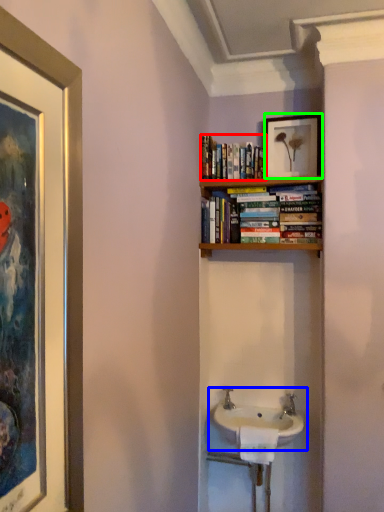
Question: Which object is positioned closest to book (highlighted by a red box)? Select from sink (highlighted by a blue box) and picture frame (highlighted by a green box).

Choices:
 (A) sink
 (B) picture frame

Answer: (B)